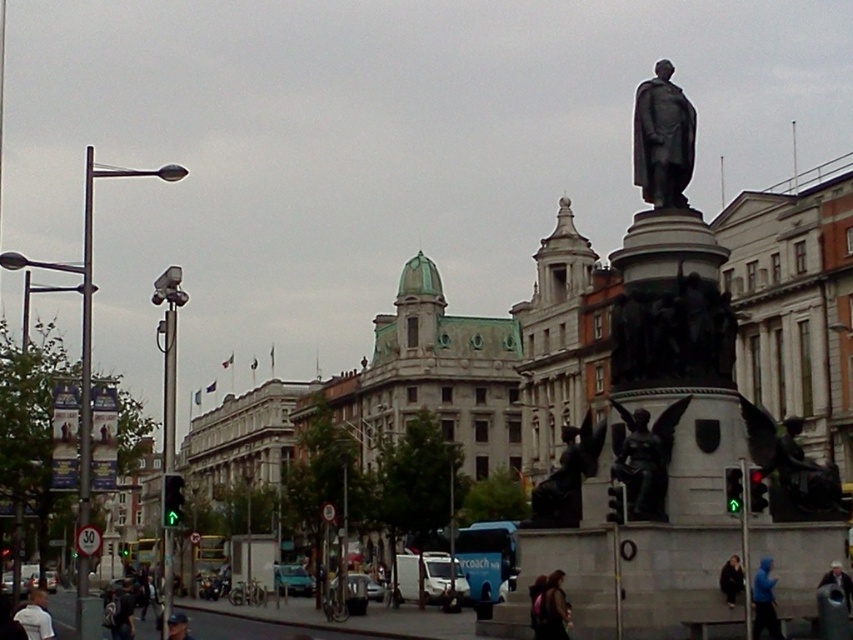
Question: Among these points, which one is farthest from the camera?

Choices:
 (A) pyautogui.click(x=183, y=634)
 (B) pyautogui.click(x=21, y=609)
 (C) pyautogui.click(x=846, y=592)
 (D) pyautogui.click(x=548, y=628)

Answer: (B)

Question: Is polished bronze angel at center thinner than bronze statue at center?

Choices:
 (A) yes
 (B) no

Answer: (A)

Question: Among these objects, which one is nearest to the camera?

Choices:
 (A) light brown hair at lower left
 (B) bronze statue at upper right
 (C) white fabric bag at lower right
 (D) polished bronze angel at center

Answer: (A)

Question: Can you confirm if bronze statue at center is positioned above dark blue baseball cap at lower left?

Choices:
 (A) no
 (B) yes

Answer: (B)

Question: Which of the following is the closest to the observer?

Choices:
 (A) (560, 580)
 (B) (761, 557)
 (C) (654, 516)

Answer: (A)

Question: Does bronze statue at upper right come in front of dark blue baseball cap at lower left?

Choices:
 (A) yes
 (B) no

Answer: (B)